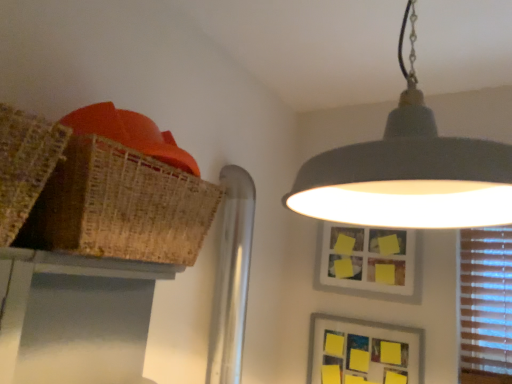
The height and width of the screenshot is (384, 512). I want to click on yellow paper picture frame at lower right, the first picture frame when ordered from bottom to top, so click(x=362, y=352).

The width and height of the screenshot is (512, 384). Identify the location of braided wicker basket at upper left. (134, 205).

Image resolution: width=512 pixels, height=384 pixels. Describe the element at coordinates (368, 258) in the screenshot. I see `yellow matte picture frame at upper center, marked as the 2th picture frame in a bottom-to-top arrangement` at that location.

Where is `yellow paper picture frame at lower right, which is counted as the second picture frame, starting from the top`? yellow paper picture frame at lower right, which is counted as the second picture frame, starting from the top is located at coordinates (362, 352).

Which is correct: matte gray lampshade at upper center is inside bamboo table at upper left, or outside of it?

matte gray lampshade at upper center is spatially situated outside bamboo table at upper left.

Which object is more forward, matte gray lampshade at upper center or bamboo table at upper left?

Positioned in front is matte gray lampshade at upper center.

Which is in front, point (447, 152) or point (94, 260)?

The point (447, 152) is closer.

Which object is positioned more to the right, matte gray lampshade at upper center or bamboo table at upper left?

From the viewer's perspective, matte gray lampshade at upper center appears more on the right side.

Considering the points (180, 214) and (159, 275), which point is behind, point (180, 214) or point (159, 275)?

The point (159, 275) is behind.

In the image, there is a braided wicker basket at upper left. At what (x,y) coordinates should I click in order to perform the action: click on table below it (from a real-world perspective). Please return your answer as a coordinate pair (x, y). The height and width of the screenshot is (384, 512). Looking at the image, I should click on (75, 317).

From a real-world perspective, is braided wicker basket at upper left on bamboo table at upper left?

Correct, in the physical world, braided wicker basket at upper left is higher than bamboo table at upper left.

Is braided wicker basket at upper left in front of or behind bamboo table at upper left in the image?

Clearly, braided wicker basket at upper left is in front of bamboo table at upper left.

Is yellow matte picture frame at upper center, the 1th picture frame from the top, aimed at yellow paper picture frame at lower right, which is counted as the second picture frame, starting from the top?

No, yellow matte picture frame at upper center, the 1th picture frame from the top, does not turn towards yellow paper picture frame at lower right, which is counted as the second picture frame, starting from the top.

Is yellow matte picture frame at upper center, the 1th picture frame from the top, directly adjacent to yellow paper picture frame at lower right, which is counted as the second picture frame, starting from the top?

yellow matte picture frame at upper center, the 1th picture frame from the top, is not next to yellow paper picture frame at lower right, which is counted as the second picture frame, starting from the top, and they're not touching.

Is yellow matte picture frame at upper center, marked as the 2th picture frame in a bottom-to-top arrangement, shorter than yellow paper picture frame at lower right, the first picture frame when ordered from bottom to top?

In fact, yellow matte picture frame at upper center, marked as the 2th picture frame in a bottom-to-top arrangement, may be taller than yellow paper picture frame at lower right, the first picture frame when ordered from bottom to top.

From a real-world perspective, which is physically above, yellow matte picture frame at upper center, the 1th picture frame from the top, or yellow paper picture frame at lower right, which is counted as the second picture frame, starting from the top?

In real-world perspective, yellow matte picture frame at upper center, the 1th picture frame from the top, is above.

From their relative heights in the image, would you say braided wicker basket at upper left is taller or shorter than yellow matte picture frame at upper center, the 1th picture frame from the top?

In the image, braided wicker basket at upper left appears to be shorter than yellow matte picture frame at upper center, the 1th picture frame from the top.

Is braided wicker basket at upper left completely or partially outside of yellow matte picture frame at upper center, the 1th picture frame from the top?

Yes.

Identify the location of basket that appears above the yellow matte picture frame at upper center, the 1th picture frame from the top (from the image's perspective). This screenshot has width=512, height=384. (134, 205).

Between braided wicker basket at upper left and yellow matte picture frame at upper center, marked as the 2th picture frame in a bottom-to-top arrangement, which one appears on the right side from the viewer's perspective?

yellow matte picture frame at upper center, marked as the 2th picture frame in a bottom-to-top arrangement.

Who is bigger, yellow paper picture frame at lower right, the first picture frame when ordered from bottom to top, or braided wicker basket at upper left?

Bigger between the two is braided wicker basket at upper left.

Which object is wider, yellow paper picture frame at lower right, which is counted as the second picture frame, starting from the top, or braided wicker basket at upper left?

braided wicker basket at upper left.

Is point (369, 376) closer or farther from the camera than point (152, 206)?

Clearly, point (369, 376) is more distant from the camera than point (152, 206).

Are yellow paper picture frame at lower right, which is counted as the second picture frame, starting from the top, and braided wicker basket at upper left located far from each other?

Yes, yellow paper picture frame at lower right, which is counted as the second picture frame, starting from the top, and braided wicker basket at upper left are quite far apart.

Does yellow matte picture frame at upper center, marked as the 2th picture frame in a bottom-to-top arrangement, contain bamboo table at upper left?

No, yellow matte picture frame at upper center, marked as the 2th picture frame in a bottom-to-top arrangement, does not contain bamboo table at upper left.

Which point is more distant from viewer, (379, 232) or (5, 298)?

Point (379, 232)

Are yellow matte picture frame at upper center, the 1th picture frame from the top, and bamboo table at upper left located far from each other?

Absolutely, yellow matte picture frame at upper center, the 1th picture frame from the top, is distant from bamboo table at upper left.

Is the position of bamboo table at upper left less distant than that of yellow paper picture frame at lower right, which is counted as the second picture frame, starting from the top?

Yes, the depth of bamboo table at upper left is less than that of yellow paper picture frame at lower right, which is counted as the second picture frame, starting from the top.

Can you confirm if bamboo table at upper left is wider than yellow paper picture frame at lower right, which is counted as the second picture frame, starting from the top?

Indeed, bamboo table at upper left has a greater width compared to yellow paper picture frame at lower right, which is counted as the second picture frame, starting from the top.

Is bamboo table at upper left spatially inside yellow paper picture frame at lower right, which is counted as the second picture frame, starting from the top, or outside of it?

bamboo table at upper left is located beyond the bounds of yellow paper picture frame at lower right, which is counted as the second picture frame, starting from the top.

Would you consider bamboo table at upper left to be distant from yellow paper picture frame at lower right, the first picture frame when ordered from bottom to top?

Yes, bamboo table at upper left and yellow paper picture frame at lower right, the first picture frame when ordered from bottom to top, are located far from each other.

In order to click on lamp that appears in front of the bamboo table at upper left in this screenshot , I will do `click(408, 173)`.

The width and height of the screenshot is (512, 384). Find the location of `basket on the right of bamboo table at upper left`. basket on the right of bamboo table at upper left is located at coordinates (134, 205).

Based on their spatial positions, is matte gray lampshade at upper center or braided wicker basket at upper left further from yellow paper picture frame at lower right, the first picture frame when ordered from bottom to top?

braided wicker basket at upper left lies further to yellow paper picture frame at lower right, the first picture frame when ordered from bottom to top, than the other object.

From the image, which object appears to be nearer to matte gray lampshade at upper center, yellow paper picture frame at lower right, which is counted as the second picture frame, starting from the top, or bamboo table at upper left?

bamboo table at upper left is closer to matte gray lampshade at upper center.

Looking at the image, which one is located further to yellow paper picture frame at lower right, the first picture frame when ordered from bottom to top, yellow matte picture frame at upper center, marked as the 2th picture frame in a bottom-to-top arrangement, or braided wicker basket at upper left?

Based on the image, braided wicker basket at upper left appears to be further to yellow paper picture frame at lower right, the first picture frame when ordered from bottom to top.

From the image, which object appears to be farther from yellow paper picture frame at lower right, the first picture frame when ordered from bottom to top, braided wicker basket at upper left or matte gray lampshade at upper center?

braided wicker basket at upper left is further to yellow paper picture frame at lower right, the first picture frame when ordered from bottom to top.

Looking at the image, which one is located closer to braided wicker basket at upper left, bamboo table at upper left or matte gray lampshade at upper center?

Among the two, bamboo table at upper left is located nearer to braided wicker basket at upper left.

Considering their positions, is yellow matte picture frame at upper center, marked as the 2th picture frame in a bottom-to-top arrangement, positioned closer to matte gray lampshade at upper center than yellow paper picture frame at lower right, the first picture frame when ordered from bottom to top?

yellow matte picture frame at upper center, marked as the 2th picture frame in a bottom-to-top arrangement.

Estimate the real-world distances between objects in this image. Which object is further from yellow matte picture frame at upper center, the 1th picture frame from the top, matte gray lampshade at upper center or braided wicker basket at upper left?

braided wicker basket at upper left is further to yellow matte picture frame at upper center, the 1th picture frame from the top.

Looking at the image, which one is located closer to matte gray lampshade at upper center, bamboo table at upper left or yellow paper picture frame at lower right, the first picture frame when ordered from bottom to top?

bamboo table at upper left is positioned closer to the anchor matte gray lampshade at upper center.

You are a GUI agent. You are given a task and a screenshot of the screen. Output one action in this format:
    pyautogui.click(x=<x>, y=<y>)
    Task: Click on the basket between matte gray lampshade at upper center and yellow matte picture frame at upper center, the 1th picture frame from the top, in the front-back direction
    
    Given the screenshot: What is the action you would take?
    pyautogui.click(x=134, y=205)

Locate an element on the screen. The image size is (512, 384). picture frame positioned between braided wicker basket at upper left and yellow matte picture frame at upper center, marked as the 2th picture frame in a bottom-to-top arrangement, from near to far is located at coordinates (362, 352).

What are the coordinates of `table positioned between matte gray lampshade at upper center and yellow paper picture frame at lower right, the first picture frame when ordered from bottom to top, from near to far` in the screenshot? It's located at (75, 317).

At what (x,y) coordinates should I click in order to perform the action: click on basket between matte gray lampshade at upper center and yellow paper picture frame at lower right, the first picture frame when ordered from bottom to top, along the z-axis. Please return your answer as a coordinate pair (x, y). This screenshot has height=384, width=512. Looking at the image, I should click on tap(134, 205).